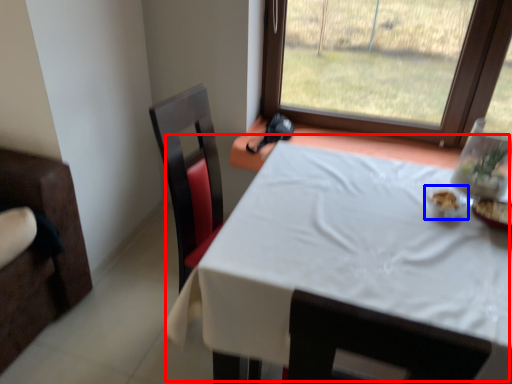
Question: Among these objects, which one is farthest to the camera, table (highlighted by a red box) or tableware (highlighted by a blue box)?

Choices:
 (A) table
 (B) tableware

Answer: (B)